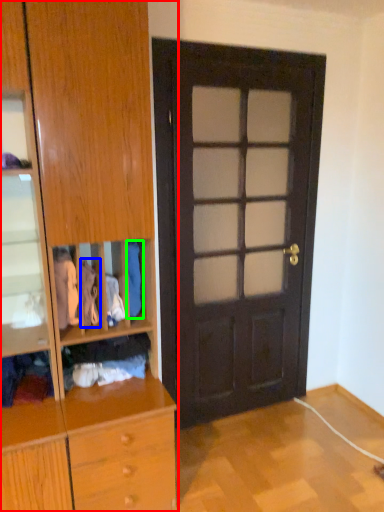
Question: Based on their relative distances, which object is nearer to cabinetry (highlighted by a red box)? Choose from clothing (highlighted by a blue box) and clothing (highlighted by a green box).

Choices:
 (A) clothing
 (B) clothing

Answer: (A)